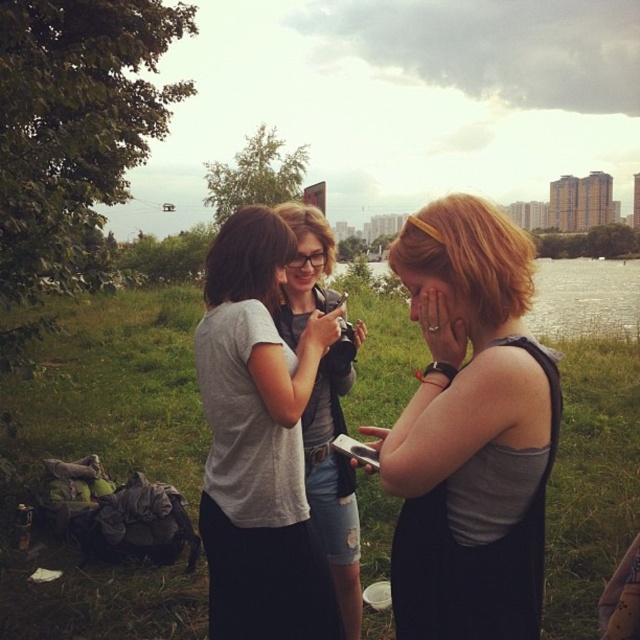
Does matte gray tank top at center have a lesser width compared to gray cotton t-shirt at center?

Indeed, matte gray tank top at center has a lesser width compared to gray cotton t-shirt at center.

Which is in front, point (468, 566) or point (225, 589)?

Point (468, 566)

The image size is (640, 640). In order to click on matte gray tank top at center in this screenshot , I will do `click(468, 432)`.

Is the position of gray cotton t-shirt at center more distant than that of transparent water at center?

Yes, gray cotton t-shirt at center is further from the viewer.

Based on the photo, between gray cotton t-shirt at center and transparent water at center, which one has less height?

gray cotton t-shirt at center is shorter.

The image size is (640, 640). Find the location of `gray cotton t-shirt at center`. gray cotton t-shirt at center is located at coordinates (259, 442).

Which of these two, matte gray tank top at center or matte black phone at center, stands shorter?

With less height is matte gray tank top at center.

Can you confirm if matte gray tank top at center is positioned to the right of matte black phone at center?

Correct, you'll find matte gray tank top at center to the right of matte black phone at center.

Who is more forward, (536, 406) or (344, 484)?

Positioned in front is point (536, 406).

Locate an element on the screen. matte gray tank top at center is located at coordinates point(468,432).